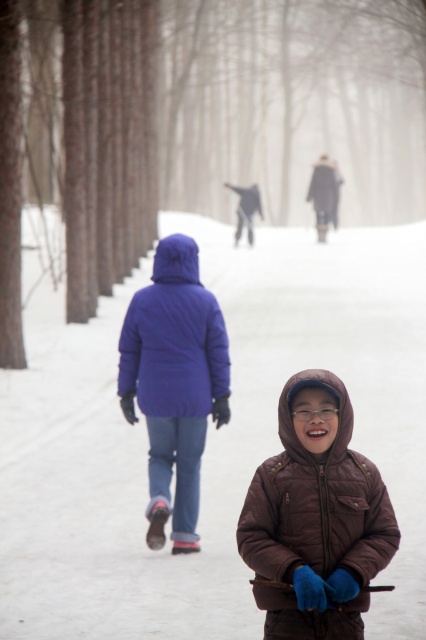
Question: Does brown quilted jacket at center appear under matte blue jacket at center?

Choices:
 (A) yes
 (B) no

Answer: (A)

Question: Does brown quilted jacket at center have a larger size compared to matte blue jacket at center?

Choices:
 (A) no
 (B) yes

Answer: (A)

Question: Which of the following is the farthest from the observer?

Choices:
 (A) matte blue jacket at center
 (B) brown quilted jacket at center

Answer: (A)

Question: Among these objects, which one is farthest from the camera?

Choices:
 (A) matte blue jacket at center
 (B) brown quilted jacket at center

Answer: (A)

Question: Which point is farther to the camera?

Choices:
 (A) brown quilted jacket at center
 (B) matte blue jacket at center

Answer: (B)

Question: Observing the image, what is the correct spatial positioning of brown quilted jacket at center in reference to matte blue jacket at center?

Choices:
 (A) left
 (B) right

Answer: (B)